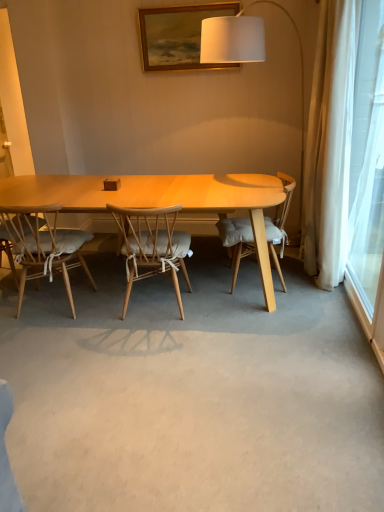
How much space does natural wood chair with cushion at center, the 2th chair in the left-to-right sequence, occupy horizontally?

natural wood chair with cushion at center, the 2th chair in the left-to-right sequence, is 58.21 centimeters wide.

The height and width of the screenshot is (512, 384). What do you see at coordinates (232, 39) in the screenshot?
I see `white fabric lampshade at upper center` at bounding box center [232, 39].

What do you see at coordinates (178, 36) in the screenshot? The width and height of the screenshot is (384, 512). I see `wooden picture frame at upper center` at bounding box center [178, 36].

This screenshot has width=384, height=512. Find the location of `light wood chair with cushion at center, the 3th chair in the left-to-right sequence`. light wood chair with cushion at center, the 3th chair in the left-to-right sequence is located at coordinates (237, 241).

Does white fabric lampshade at upper center have a lesser height compared to natural wood chair with cushion at center, which is the 2th chair from right to left?

In fact, white fabric lampshade at upper center may be taller than natural wood chair with cushion at center, which is the 2th chair from right to left.

Is white fabric lampshade at upper center oriented away from natural wood chair with cushion at center, the 2th chair in the left-to-right sequence?

No, white fabric lampshade at upper center is not facing away from natural wood chair with cushion at center, the 2th chair in the left-to-right sequence.

Does white fabric lampshade at upper center have a greater width compared to natural wood chair with cushion at center, the 2th chair in the left-to-right sequence?

No.

Is white fabric lampshade at upper center outside of natural wood chair with cushion at center, the 2th chair in the left-to-right sequence?

white fabric lampshade at upper center is positioned outside natural wood chair with cushion at center, the 2th chair in the left-to-right sequence.

Does point (352, 281) come closer to viewer compared to point (53, 233)?

No, (352, 281) is further to viewer.

From the image's perspective, which one is positioned lower, transparent glass window at right or light wood chair with white cushion at left, which is the first chair in left-to-right order?

light wood chair with white cushion at left, which is the first chair in left-to-right order.

Is transparent glass window at right shorter than light wood chair with white cushion at left, which is the first chair in left-to-right order?

Incorrect, the height of transparent glass window at right does not fall short of that of light wood chair with white cushion at left, which is the first chair in left-to-right order.

Is transparent glass window at right not within light wood chair with white cushion at left, which is the first chair in left-to-right order?

transparent glass window at right lies outside light wood chair with white cushion at left, which is the first chair in left-to-right order,'s area.

Identify the location of lamp above the light wood chair with white cushion at left, which is the first chair in left-to-right order (from a real-world perspective). The height and width of the screenshot is (512, 384). (232, 39).

Can we say white fabric lampshade at upper center lies outside light wood chair with white cushion at left, acting as the third chair starting from the right?

Yes, white fabric lampshade at upper center is not within light wood chair with white cushion at left, acting as the third chair starting from the right.

Are white fabric lampshade at upper center and light wood chair with white cushion at left, which is the first chair in left-to-right order, beside each other?

No, white fabric lampshade at upper center is not next to light wood chair with white cushion at left, which is the first chair in left-to-right order.

Between point (7, 228) and point (139, 15), which one is positioned behind?

Positioned behind is point (139, 15).

From the picture: Which is more to the right, light wood chair with white cushion at left, acting as the third chair starting from the right, or wooden picture frame at upper center?

From the viewer's perspective, wooden picture frame at upper center appears more on the right side.

Which is in front, light wood chair with white cushion at left, acting as the third chair starting from the right, or wooden picture frame at upper center?

light wood chair with white cushion at left, acting as the third chair starting from the right.

Is white fabric lampshade at upper center located outside light wood chair with cushion at center, the 3th chair in the left-to-right sequence?

white fabric lampshade at upper center lies outside light wood chair with cushion at center, the 3th chair in the left-to-right sequence,'s area.

From the picture: Between white fabric lampshade at upper center and light wood chair with cushion at center, the 1th chair positioned from the right, which one is positioned in front?

white fabric lampshade at upper center is closer to the camera.

Considering the sizes of objects white fabric lampshade at upper center and light wood chair with cushion at center, the 3th chair in the left-to-right sequence, in the image provided, who is bigger, white fabric lampshade at upper center or light wood chair with cushion at center, the 3th chair in the left-to-right sequence,?

white fabric lampshade at upper center is bigger.

What's the angular difference between white fabric lampshade at upper center and light wood chair with cushion at center, the 1th chair positioned from the right,'s facing directions?

The angle between the facing direction of white fabric lampshade at upper center and the facing direction of light wood chair with cushion at center, the 1th chair positioned from the right, is 2.08 degrees.

From the picture: From the image's perspective, does wooden picture frame at upper center appear lower than light wood chair with white cushion at left, which is the first chair in left-to-right order?

No, from the image's perspective, wooden picture frame at upper center is not beneath light wood chair with white cushion at left, which is the first chair in left-to-right order.

Is wooden picture frame at upper center with light wood chair with white cushion at left, acting as the third chair starting from the right?

There is a gap between wooden picture frame at upper center and light wood chair with white cushion at left, acting as the third chair starting from the right.

Is wooden picture frame at upper center surrounding light wood chair with white cushion at left, which is the first chair in left-to-right order?

No, light wood chair with white cushion at left, which is the first chair in left-to-right order, is located outside of wooden picture frame at upper center.

From the wooden picture frame at upper center, count 2nd chairs forward and point to it. Please provide its 2D coordinates.

[(44, 246)]

In the scene shown: Considering the relative sizes of light wood chair with cushion at center, the 1th chair positioned from the right, and white fabric lampshade at upper center in the image provided, is light wood chair with cushion at center, the 1th chair positioned from the right, shorter than white fabric lampshade at upper center?

Yes, light wood chair with cushion at center, the 1th chair positioned from the right, is shorter than white fabric lampshade at upper center.

Which is more to the right, light wood chair with cushion at center, the 1th chair positioned from the right, or white fabric lampshade at upper center?

From the viewer's perspective, light wood chair with cushion at center, the 1th chair positioned from the right, appears more on the right side.

Is light wood chair with cushion at center, the 1th chair positioned from the right, oriented towards white fabric lampshade at upper center?

Yes, light wood chair with cushion at center, the 1th chair positioned from the right, is aimed at white fabric lampshade at upper center.

What are the coordinates of `chair that is the 1st object to the left of the white fabric lampshade at upper center, starting at the anchor` in the screenshot? It's located at (152, 245).

The image size is (384, 512). What are the coordinates of `window screen above the light wood chair with white cushion at left, which is the first chair in left-to-right order (from a real-world perspective)` in the screenshot? It's located at (367, 160).

Based on their spatial positions, is wooden picture frame at upper center or white fabric lampshade at upper center further from natural wood chair with cushion at center, the 2th chair in the left-to-right sequence?

wooden picture frame at upper center is positioned further to the anchor natural wood chair with cushion at center, the 2th chair in the left-to-right sequence.

When comparing their distances from white fabric lampshade at upper center, does transparent glass window at right or natural wood chair with cushion at center, the 2th chair in the left-to-right sequence, seem closer?

natural wood chair with cushion at center, the 2th chair in the left-to-right sequence, is positioned closer to the anchor white fabric lampshade at upper center.

From the image, which object appears to be farther from light wood chair with cushion at center, the 3th chair in the left-to-right sequence, natural wood chair with cushion at center, the 2th chair in the left-to-right sequence, or transparent glass window at right?

Based on the image, transparent glass window at right appears to be further to light wood chair with cushion at center, the 3th chair in the left-to-right sequence.

Looking at the image, which one is located closer to natural wood chair with cushion at center, which is the 2th chair from right to left, white fabric lampshade at upper center or transparent glass window at right?

white fabric lampshade at upper center is positioned closer to the anchor natural wood chair with cushion at center, which is the 2th chair from right to left.

Based on their spatial positions, is wooden picture frame at upper center or transparent glass window at right further from light wood chair with white cushion at left, acting as the third chair starting from the right?

transparent glass window at right is positioned further to the anchor light wood chair with white cushion at left, acting as the third chair starting from the right.

Based on their spatial positions, is white fabric lampshade at upper center or transparent glass window at right closer to light wood chair with cushion at center, the 1th chair positioned from the right?

Based on the image, white fabric lampshade at upper center appears to be nearer to light wood chair with cushion at center, the 1th chair positioned from the right.

Based on their spatial positions, is white fabric lampshade at upper center or wooden picture frame at upper center further from natural wood chair with cushion at center, the 2th chair in the left-to-right sequence?

The object further to natural wood chair with cushion at center, the 2th chair in the left-to-right sequence, is wooden picture frame at upper center.

Looking at the image, which one is located further to transparent glass window at right, light wood chair with white cushion at left, which is the first chair in left-to-right order, or light wood chair with cushion at center, the 1th chair positioned from the right?

light wood chair with white cushion at left, which is the first chair in left-to-right order.

Locate an element on the screen. This screenshot has width=384, height=512. lamp between natural wood chair with cushion at center, the 2th chair in the left-to-right sequence, and light wood chair with cushion at center, the 3th chair in the left-to-right sequence is located at coordinates (232, 39).

Find the location of a particular element. The height and width of the screenshot is (512, 384). picture frame between light wood chair with white cushion at left, which is the first chair in left-to-right order, and transparent glass window at right from left to right is located at coordinates (178, 36).

The height and width of the screenshot is (512, 384). Identify the location of window screen between wooden picture frame at upper center and light wood chair with cushion at center, the 3th chair in the left-to-right sequence, in the vertical direction. (367, 160).

Find the location of a particular element. Image resolution: width=384 pixels, height=512 pixels. lamp between wooden picture frame at upper center and light wood chair with white cushion at left, acting as the third chair starting from the right, in the vertical direction is located at coordinates (232, 39).